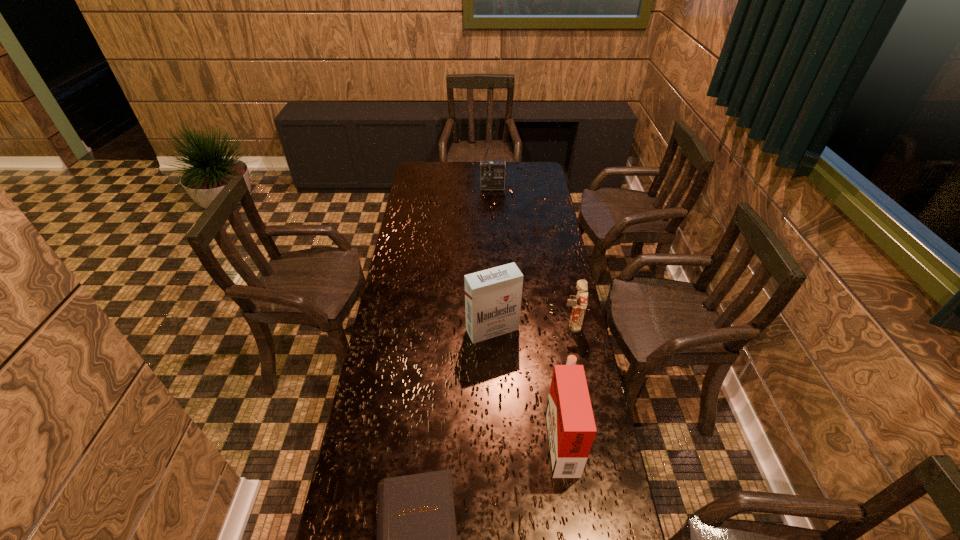
You are a GUI agent. You are given a task and a screenshot of the screen. Output one action in this format:
    pyautogui.click(x=<x>, y=<y>)
    Task: Click on the farthest object
    The width and height of the screenshot is (960, 540).
    Given the screenshot: What is the action you would take?
    pyautogui.click(x=493, y=173)

Find the location of a particular element. Image resolution: width=960 pixels, height=540 pixels. the farther cigarette case is located at coordinates (493, 296).

Find the location of `the fourth object from left to right`. the fourth object from left to right is located at coordinates 571,429.

I want to click on the right cigarette case, so click(x=571, y=429).

Locate an element on the screen. Image resolution: width=960 pixels, height=540 pixels. the rightmost object is located at coordinates (579, 302).

The width and height of the screenshot is (960, 540). In order to click on free space located on the display of the farthest object in this screenshot , I will do `click(493, 212)`.

The width and height of the screenshot is (960, 540). Identify the location of free spot located on the left of the left cigarette case. (440, 329).

Locate an element on the screen. free region located 0.270m on the front-facing side of the second object from right to left is located at coordinates (460, 437).

This screenshot has width=960, height=540. Identify the location of vacant region located 0.230m on the front-facing side of the second object from right to left. (472, 437).

At what (x,y) coordinates should I click in order to perform the action: click on vacant region located on the front-facing side of the second object from right to left. Please return your answer as a coordinate pair (x, y). This screenshot has width=960, height=540. Looking at the image, I should click on (483, 437).